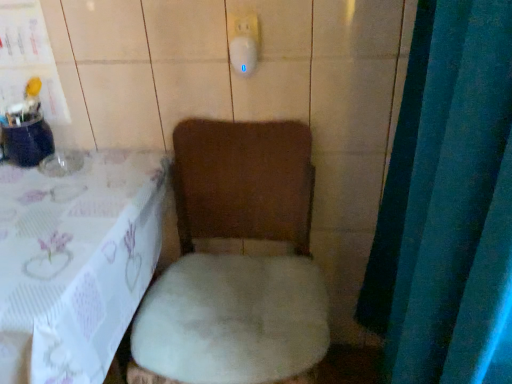
Question: Should I look upward or downward to see blue fabric curtain at right?

Choices:
 (A) up
 (B) down

Answer: (B)

Question: Does white plush chair at lower left have a lesser width compared to blue fabric curtain at right?

Choices:
 (A) yes
 (B) no

Answer: (B)

Question: From a real-world perspective, does white plush chair at lower left sit lower than blue fabric curtain at right?

Choices:
 (A) no
 (B) yes

Answer: (B)

Question: Does white plush chair at lower left have a lesser height compared to blue fabric curtain at right?

Choices:
 (A) yes
 (B) no

Answer: (A)

Question: From a real-world perspective, is white plush chair at lower left over blue fabric curtain at right?

Choices:
 (A) no
 (B) yes

Answer: (A)

Question: Would you say white plush chair at lower left is outside blue fabric curtain at right?

Choices:
 (A) yes
 (B) no

Answer: (A)

Question: Is white plush chair at lower left at the right side of blue fabric curtain at right?

Choices:
 (A) yes
 (B) no

Answer: (B)

Question: Is white plush chair at lower left touching white plush toilet at center?

Choices:
 (A) yes
 (B) no

Answer: (B)

Question: Is white plush chair at lower left closer to camera compared to white plush toilet at center?

Choices:
 (A) no
 (B) yes

Answer: (B)

Question: Would you say white plush chair at lower left is outside white plush toilet at center?

Choices:
 (A) no
 (B) yes

Answer: (B)

Question: Could you tell me if white plush chair at lower left is facing white plush toilet at center?

Choices:
 (A) no
 (B) yes

Answer: (A)

Question: Does white plush chair at lower left have a larger size compared to white plush toilet at center?

Choices:
 (A) no
 (B) yes

Answer: (B)

Question: Considering the relative sizes of white plush chair at lower left and white plush toilet at center in the image provided, is white plush chair at lower left shorter than white plush toilet at center?

Choices:
 (A) yes
 (B) no

Answer: (A)

Question: Is white plush toilet at center oriented towards white plush chair at lower left?

Choices:
 (A) yes
 (B) no

Answer: (B)